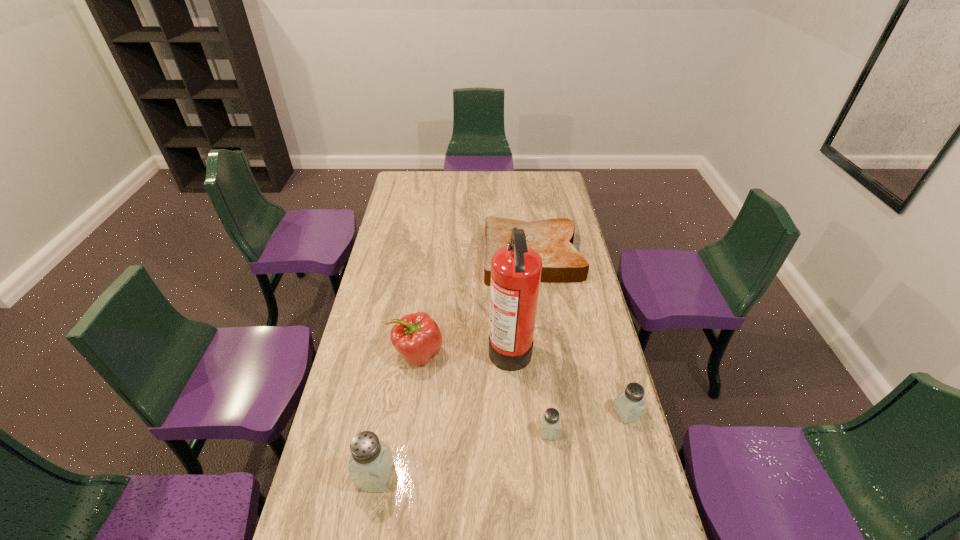
Image resolution: width=960 pixels, height=540 pixels. I want to click on free space between the tallest object and the pepper, so click(x=464, y=349).

What are the coordinates of `free space between the pepper and the fourth tallest object` in the screenshot? It's located at (522, 383).

This screenshot has width=960, height=540. In order to click on vacant space that's between the pepper and the shortest object in this screenshot , I will do `click(475, 305)`.

The image size is (960, 540). I want to click on empty space between the shortest object and the second tallest saltshaker, so click(x=579, y=335).

Identify the location of free space between the third shortest object and the pepper. The image size is (960, 540). (522, 383).

Find the location of `free space between the shortest saltshaker and the leftmost saltshaker`. free space between the shortest saltshaker and the leftmost saltshaker is located at coordinates click(462, 454).

Where is `free spot between the rightmost saltshaker and the farthest object`? The width and height of the screenshot is (960, 540). free spot between the rightmost saltshaker and the farthest object is located at coordinates (579, 335).

Select which object appears as the closest to the pepper. Please provide its 2D coordinates. Your answer should be formatted as a tuple, i.e. [(x, y)], where the tuple contains the x and y coordinates of a point satisfying the conditions above.

[(516, 269)]

Where is `the third closest object to the fire extinguisher`? This screenshot has height=540, width=960. the third closest object to the fire extinguisher is located at coordinates (562, 263).

Locate an element on the screen. the closest saltshaker to the leftmost saltshaker is located at coordinates (550, 422).